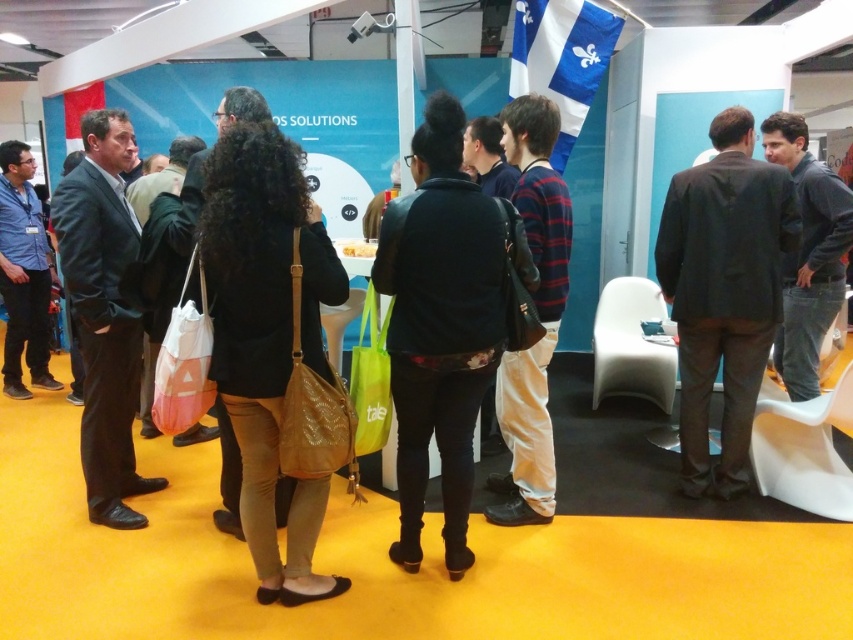
Can you confirm if dark blue jacket at center is positioned to the right of dark brown suit at center?

Incorrect, dark blue jacket at center is not on the right side of dark brown suit at center.

Can you confirm if dark blue jacket at center is shorter than dark brown suit at center?

Yes, dark blue jacket at center is shorter than dark brown suit at center.

Which is in front, point (405, 522) or point (724, 141)?

Positioned in front is point (405, 522).

Identify the location of dark blue jacket at center. This screenshot has width=853, height=640. (440, 324).